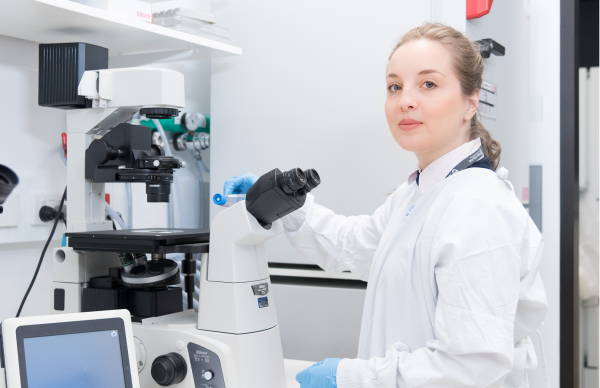
Locate an element on the screen. screen is located at coordinates (82, 357).